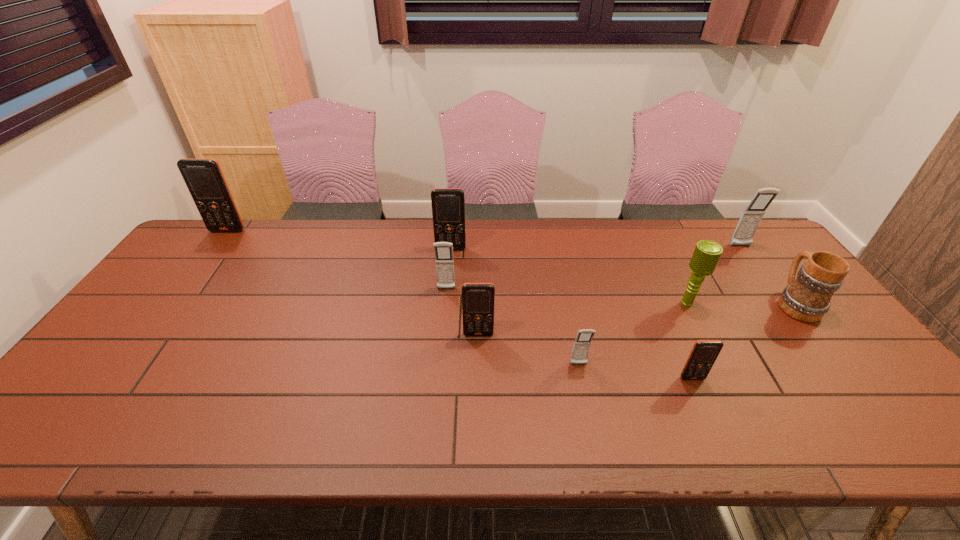
Image resolution: width=960 pixels, height=540 pixels. I want to click on the closest gray cellular telephone to the sixth farthest cellular telephone, so click(444, 259).

The image size is (960, 540). In order to click on vacant area in the image that satisfies the following two spatial constraints: 1. on the screen of the second farthest orange cellular telephone; 2. on the right side of the seventh object from left to right in this screenshot , I will do `click(446, 304)`.